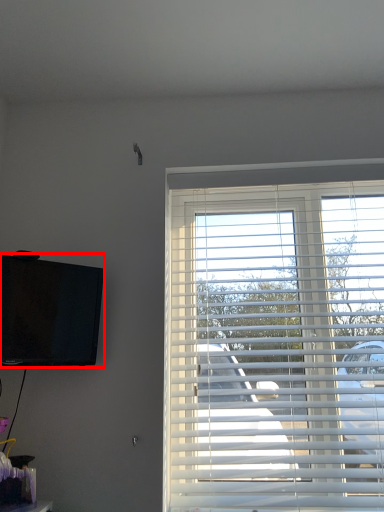
Question: In this image, where is television (annotated by the red box) located relative to window blind?

Choices:
 (A) right
 (B) left

Answer: (B)